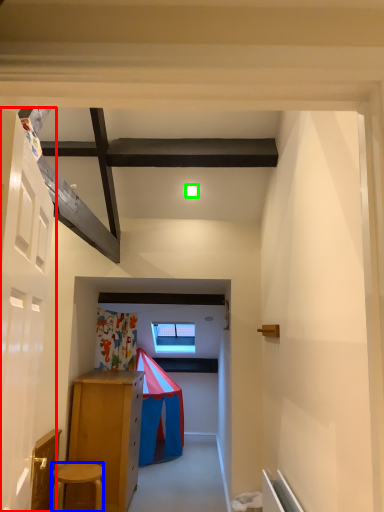
Question: Estimate the real-world distances between objects in this image. Which object is farther from door (highlighted by a red box), stool (highlighted by a blue box) or light (highlighted by a green box)?

Choices:
 (A) stool
 (B) light

Answer: (B)